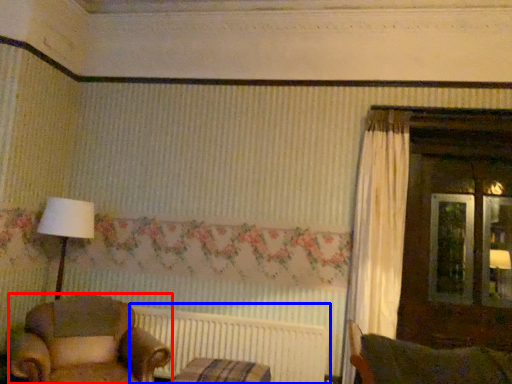
Question: Which of the following is the closest to the observer, chair (highlighted by a red box) or radiator (highlighted by a blue box)?

Choices:
 (A) chair
 (B) radiator

Answer: (A)